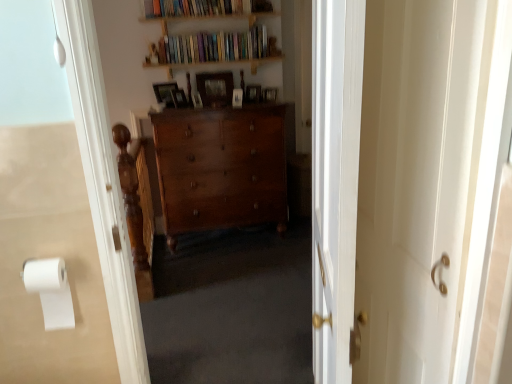
Identify the location of vacant area that lies in front of wooden picture frame at center, which is the sixth picture frame in left-to-right order. Image resolution: width=512 pixels, height=384 pixels. (269, 109).